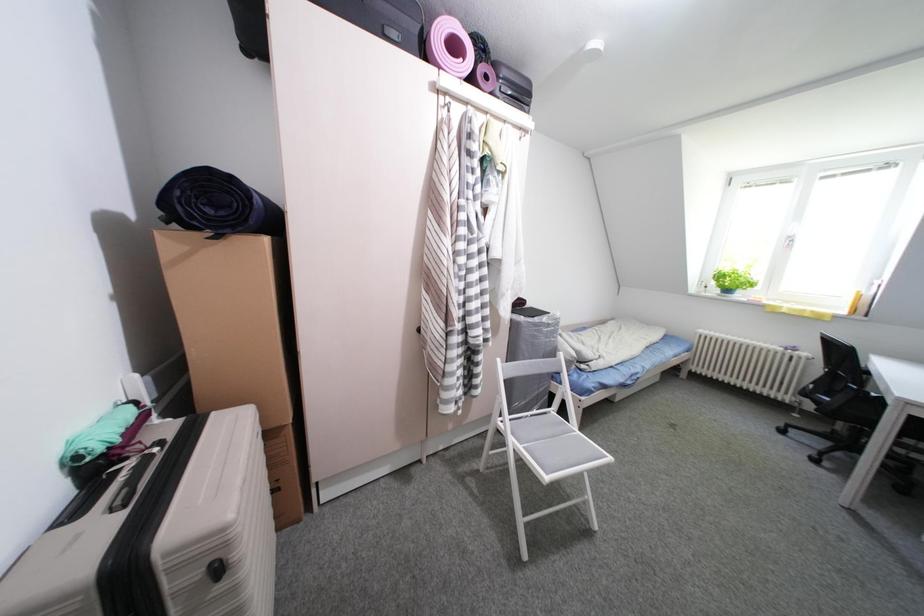
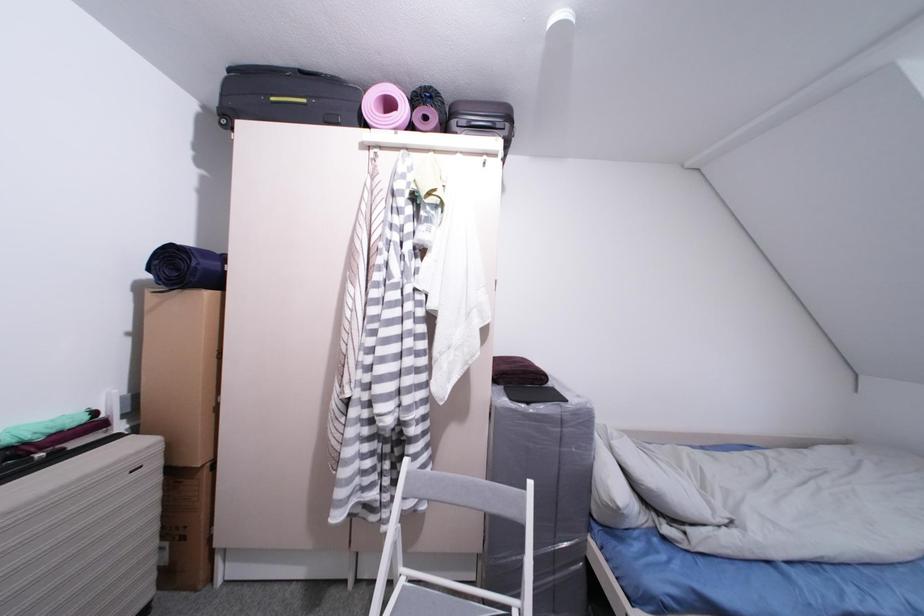
Question: How did the camera likely rotate?

Choices:
 (A) Left
 (B) Right
 (C) Up
 (D) Down

Answer: (A)